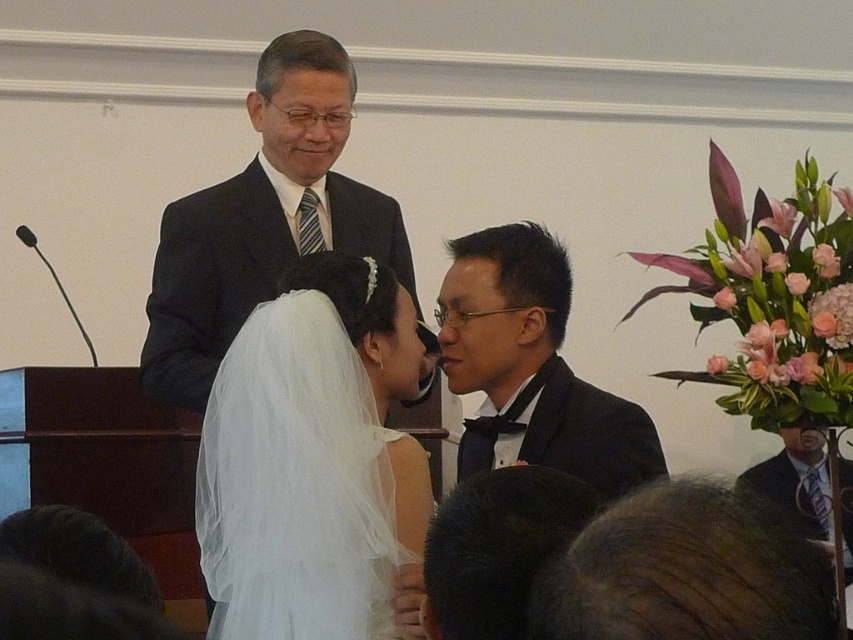
Question: Among these objects, which one is nearest to the camera?

Choices:
 (A) white tulle veil at center
 (B) dark blue suit at upper center
 (C) black satin suit at center

Answer: (A)

Question: Which of the following is the farthest from the observer?

Choices:
 (A) white tulle veil at center
 (B) dark blue suit at upper center
 (C) black satin suit at center

Answer: (B)

Question: In this image, where is white tulle veil at center located relative to dark blue suit at upper center?

Choices:
 (A) left
 (B) right

Answer: (B)

Question: Does dark blue suit at upper center appear on the left side of black satin suit at center?

Choices:
 (A) no
 (B) yes

Answer: (B)

Question: Which of these objects is positioned farthest from the white tulle veil at center?

Choices:
 (A) dark blue suit at upper center
 (B) black satin suit at center

Answer: (A)

Question: Does white tulle veil at center have a larger size compared to dark blue suit at upper center?

Choices:
 (A) no
 (B) yes

Answer: (A)